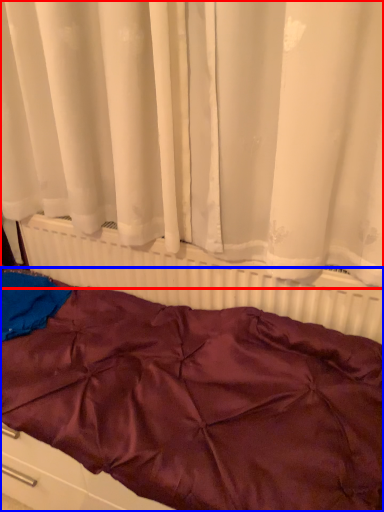
Question: Which point is closer to the camera, curtain (highlighted by a red box) or furniture (highlighted by a blue box)?

Choices:
 (A) curtain
 (B) furniture

Answer: (A)